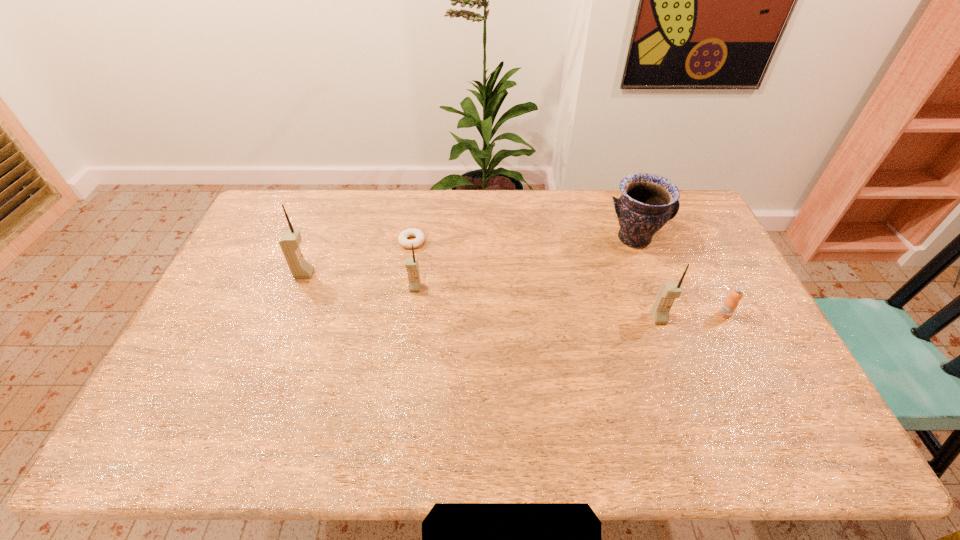
At what (x,y) coordinates should I click in order to perform the action: click on the third farthest object. Please return your answer as a coordinate pair (x, y). The height and width of the screenshot is (540, 960). Looking at the image, I should click on (300, 268).

At what (x,y) coordinates should I click in order to perform the action: click on the farthest cellular telephone. Please return your answer as a coordinate pair (x, y). Looking at the image, I should click on pos(300,268).

Where is `the shortest cellular telephone`? The width and height of the screenshot is (960, 540). the shortest cellular telephone is located at coordinates (411, 264).

The image size is (960, 540). I want to click on the second cellular telephone from left to right, so click(x=411, y=264).

At what (x,y) coordinates should I click in order to perform the action: click on the rightmost cellular telephone. Please return your answer as a coordinate pair (x, y). Looking at the image, I should click on (668, 291).

I want to click on the nearest cellular telephone, so click(668, 291).

The image size is (960, 540). Identify the location of the shortest object. (402, 238).

Identify the location of pottery. (648, 201).

The width and height of the screenshot is (960, 540). What are the coordinates of `the fifth tallest object` in the screenshot? It's located at (730, 304).

I want to click on the rightmost object, so [730, 304].